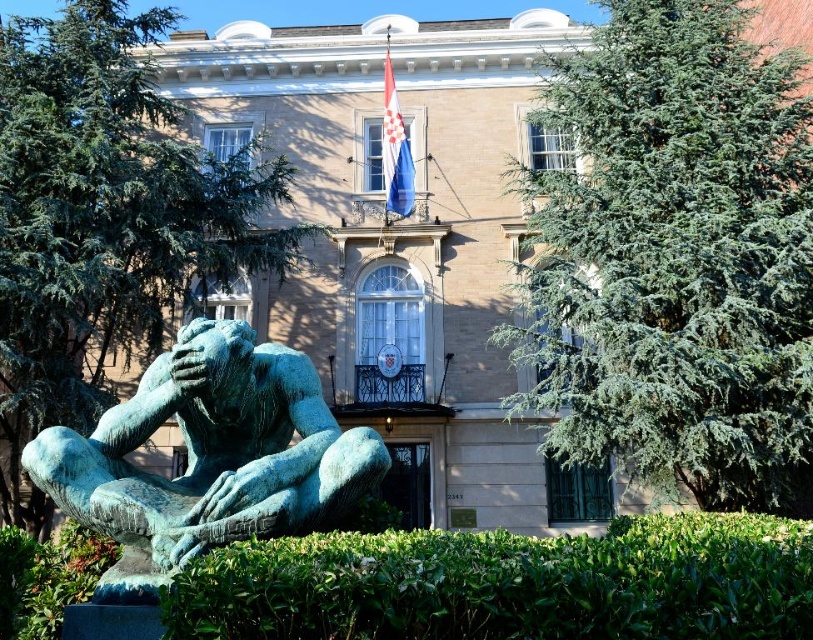
Question: Which object is closer to the camera taking this photo?

Choices:
 (A) green leafy tree at left
 (B) green patina statue at lower left
 (C) green needle-like tree at upper right

Answer: (B)

Question: Which point is closer to the camera taking this photo?

Choices:
 (A) (93, 252)
 (B) (307, 420)

Answer: (B)

Question: Considering the relative positions of green leafy bush at lower center and green patina statue at lower left in the image provided, where is green leafy bush at lower center located with respect to green patina statue at lower left?

Choices:
 (A) right
 (B) left

Answer: (A)

Question: Is green leafy bush at lower center to the left of green patina statue at lower left from the viewer's perspective?

Choices:
 (A) yes
 (B) no

Answer: (B)

Question: Is green leafy bush at lower center to the right of green patina statue at lower left from the viewer's perspective?

Choices:
 (A) yes
 (B) no

Answer: (A)

Question: Which of the following is the closest to the observer?

Choices:
 (A) green leafy bush at lower center
 (B) green needle-like tree at upper right
 (C) green leafy tree at left
 (D) green patina statue at lower left

Answer: (A)